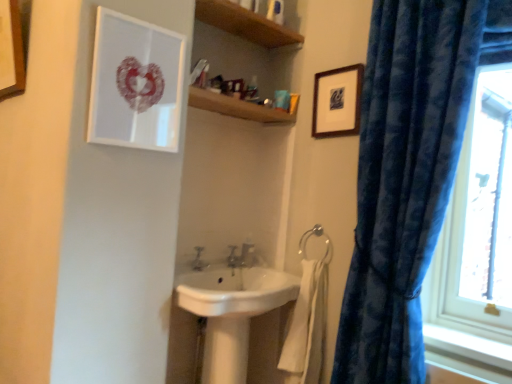
Question: Is wooden picture frame at upper right, the third picture frame when ordered from left to right, far away from matte white picture frame at upper left, which is counted as the 2th picture frame, starting from the right?

Choices:
 (A) no
 (B) yes

Answer: (A)

Question: From the image's perspective, is wooden picture frame at upper right, the third picture frame when ordered from left to right, over matte white picture frame at upper left, which is counted as the 2th picture frame, starting from the right?

Choices:
 (A) yes
 (B) no

Answer: (A)

Question: Is wooden picture frame at upper right, the third picture frame when ordered from left to right, looking in the opposite direction of matte white picture frame at upper left, which is counted as the 2th picture frame, starting from the right?

Choices:
 (A) yes
 (B) no

Answer: (B)

Question: Is matte white picture frame at upper left, which is counted as the 2th picture frame, starting from the right, a part of wooden picture frame at upper right, the third picture frame when ordered from left to right?

Choices:
 (A) yes
 (B) no

Answer: (B)

Question: Does wooden picture frame at upper right, the third picture frame when ordered from left to right, have a greater width compared to matte white picture frame at upper left, which is counted as the second picture frame, starting from the left?

Choices:
 (A) yes
 (B) no

Answer: (A)

Question: From the image's perspective, is velvety blue curtain at right positioned above or below wooden picture frame at upper left, marked as the third picture frame in a right-to-left arrangement?

Choices:
 (A) above
 (B) below

Answer: (B)

Question: In terms of width, does velvety blue curtain at right look wider or thinner when compared to wooden picture frame at upper left, acting as the 1th picture frame starting from the left?

Choices:
 (A) thin
 (B) wide

Answer: (B)

Question: Considering the positions of velvety blue curtain at right and wooden picture frame at upper left, marked as the third picture frame in a right-to-left arrangement, in the image, is velvety blue curtain at right bigger or smaller than wooden picture frame at upper left, marked as the third picture frame in a right-to-left arrangement,?

Choices:
 (A) small
 (B) big

Answer: (B)

Question: Relative to wooden picture frame at upper left, acting as the 1th picture frame starting from the left, is velvety blue curtain at right in front or behind?

Choices:
 (A) front
 (B) behind

Answer: (A)

Question: Visually, is wooden shelf at upper center positioned to the left or to the right of matte silver tap at center?

Choices:
 (A) left
 (B) right

Answer: (B)

Question: From the image's perspective, is wooden shelf at upper center located above or below matte silver tap at center?

Choices:
 (A) above
 (B) below

Answer: (A)

Question: From a real-world perspective, is wooden shelf at upper center positioned above or below matte silver tap at center?

Choices:
 (A) below
 (B) above

Answer: (B)

Question: Do you think wooden shelf at upper center is within matte silver tap at center, or outside of it?

Choices:
 (A) outside
 (B) inside

Answer: (A)

Question: Is white plastic tube at upper center in front of or behind wooden picture frame at upper left, marked as the third picture frame in a right-to-left arrangement, in the image?

Choices:
 (A) behind
 (B) front

Answer: (A)

Question: In terms of height, does white plastic tube at upper center look taller or shorter compared to wooden picture frame at upper left, marked as the third picture frame in a right-to-left arrangement?

Choices:
 (A) tall
 (B) short

Answer: (B)